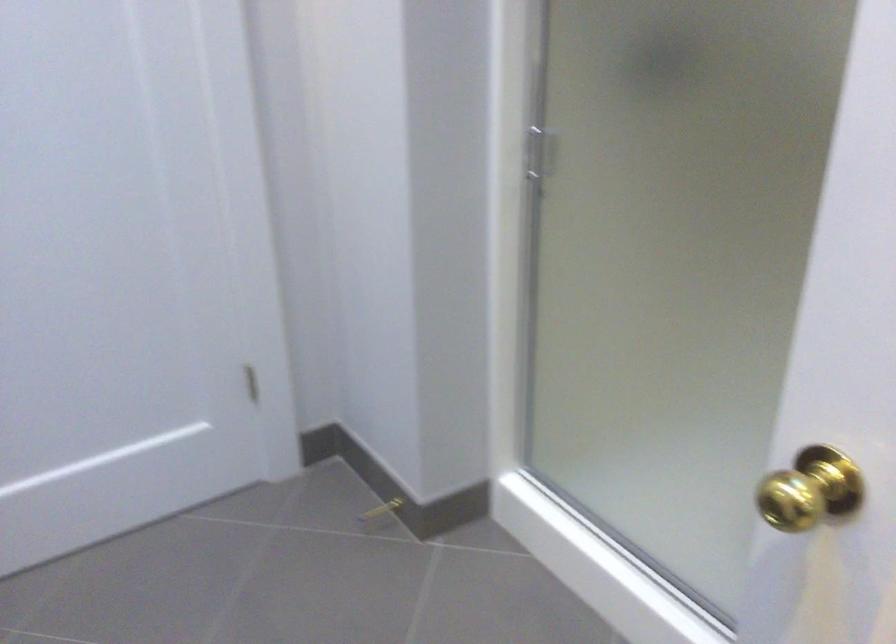
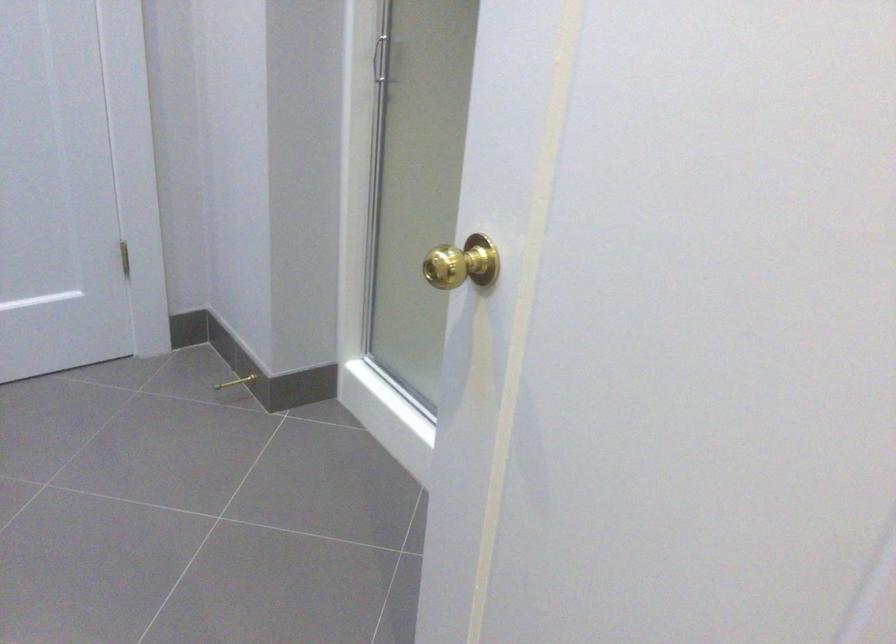
Where in the second image is the point corresponding to pixel 791 489 from the first image?

(461, 263)